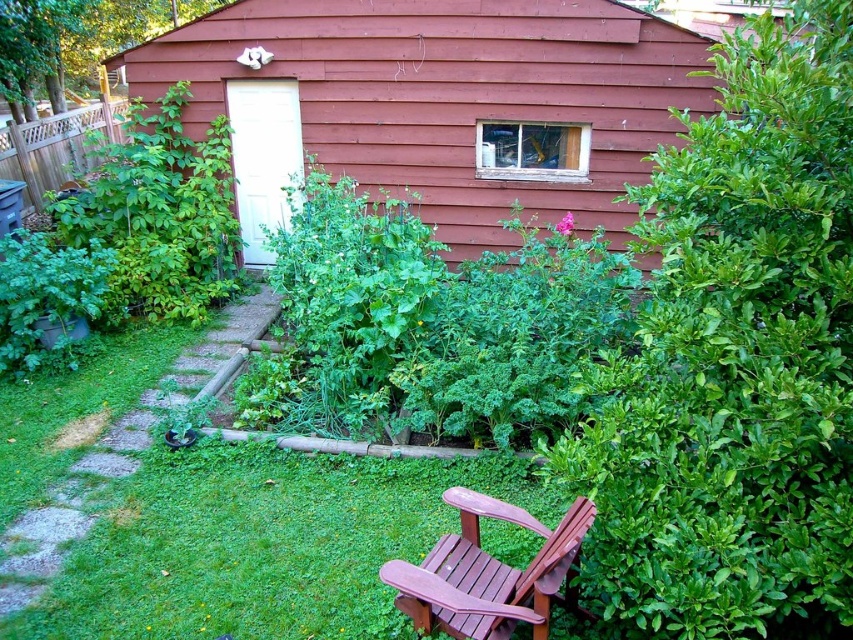
You are a gardener who needs to water both the green leafy bush at left and the mahogany wood chair at lower center. You have a watering can that can hold enough water to cover 3 meters worth of distance between objects. Do you need to refill your watering can before moving from one to the other?

The green leafy bush at left and mahogany wood chair at lower center are 4.21 meters apart from each other. Since the watering can can only cover 3 meters, you will need to refill it before moving from one to the other.

You are standing at the point with coordinates point (463, 593) and want to walk to the point with coordinates point (134, 113). Will the wooden Adirondack chair with a reddish brown finish in the foreground block your path?

Point (134, 113) is behind point (463, 593), so the wooden Adirondack chair with a reddish brown finish in the foreground will block your path.

You are standing in the backyard garden and want to move from the wooden shed at center to the mahogany wood chair at lower center. Which direction should you move in?

The wooden shed at center is located above the mahogany wood chair at lower center, so you should move downward to reach the mahogany wood chair at lower center.